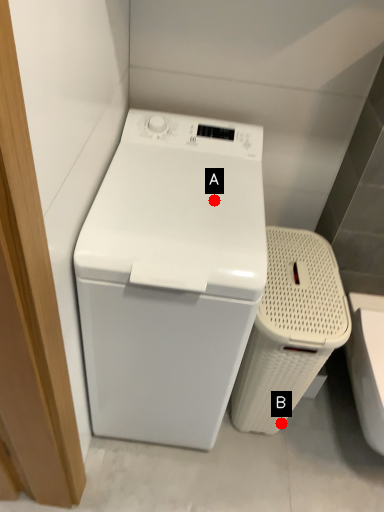
Question: Two points are circled on the image, labeled by A and B beside each circle. Which point appears farthest from the camera in this image?

Choices:
 (A) A is further
 (B) B is further

Answer: (B)